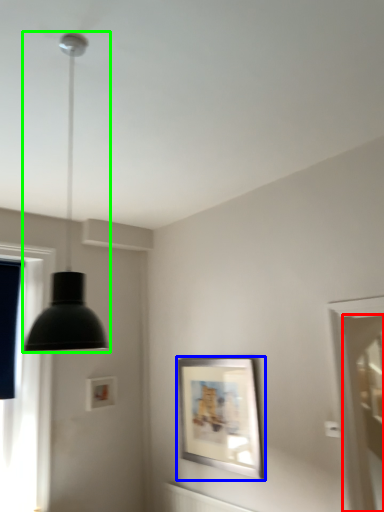
Question: Which object is the farthest from screen door (highlighted by a red box)? Choose among these: picture frame (highlighted by a blue box) or lamp (highlighted by a green box).

Choices:
 (A) picture frame
 (B) lamp

Answer: (B)